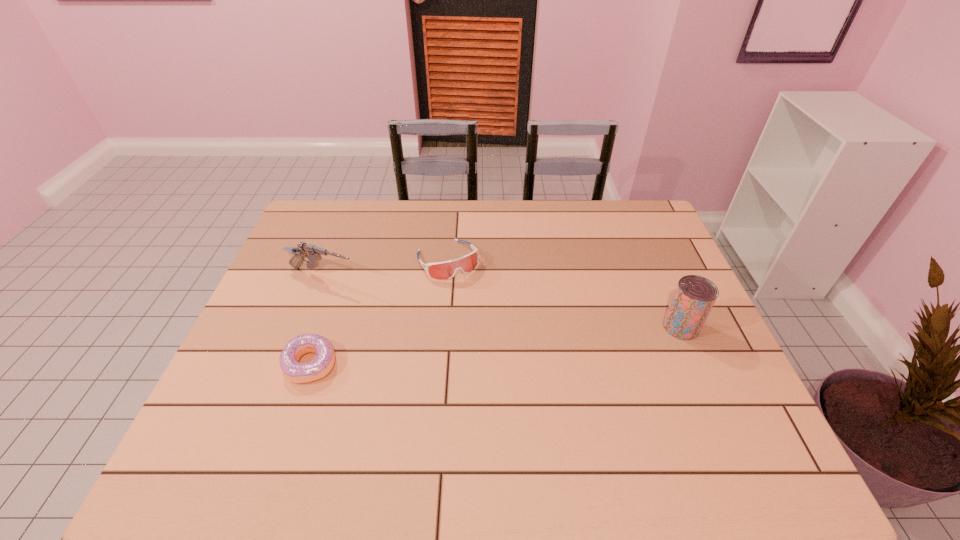
Find the location of `vacant space that is in between the shortest object and the gun`. vacant space that is in between the shortest object and the gun is located at coordinates (317, 321).

Image resolution: width=960 pixels, height=540 pixels. I want to click on free spot between the rightmost object and the second object from right to left, so click(x=564, y=293).

This screenshot has height=540, width=960. Identify the location of free space between the shortest object and the third object from left to right. (379, 312).

At what (x,y) coordinates should I click in order to perform the action: click on free space between the nearest object and the beer can. Please return your answer as a coordinate pair (x, y). This screenshot has height=540, width=960. Looking at the image, I should click on (495, 346).

At what (x,y) coordinates should I click in order to perform the action: click on object identified as the closest to the gun. Please return your answer as a coordinate pair (x, y). The width and height of the screenshot is (960, 540). Looking at the image, I should click on 441,270.

Select which object appears as the closest to the rightmost object. Please provide its 2D coordinates. Your answer should be formatted as a tuple, i.e. [(x, y)], where the tuple contains the x and y coordinates of a point satisfying the conditions above.

[(441, 270)]

Identify the location of free spot that satisfies the following two spatial constraints: 1. on the front side of the shortest object; 2. on the right side of the gun. Image resolution: width=960 pixels, height=540 pixels. (290, 364).

The height and width of the screenshot is (540, 960). I want to click on free location that satisfies the following two spatial constraints: 1. on the front side of the beer can; 2. on the left side of the third shortest object, so click(304, 327).

This screenshot has width=960, height=540. I want to click on free point that satisfies the following two spatial constraints: 1. on the back side of the third shortest object; 2. on the right side of the goggles, so click(x=329, y=260).